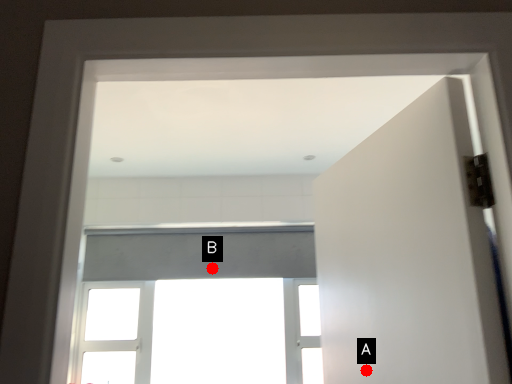
Question: Two points are circled on the image, labeled by A and B beside each circle. Among these points, which one is nearest to the camera?

Choices:
 (A) A is closer
 (B) B is closer

Answer: (A)